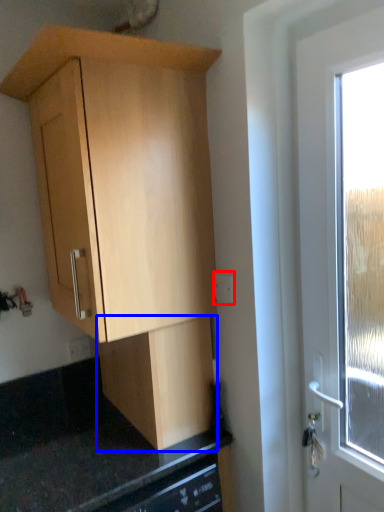
Question: Among these objects, which one is farthest to the camera, electric outlet (highlighted by a red box) or cabinetry (highlighted by a blue box)?

Choices:
 (A) electric outlet
 (B) cabinetry

Answer: (A)